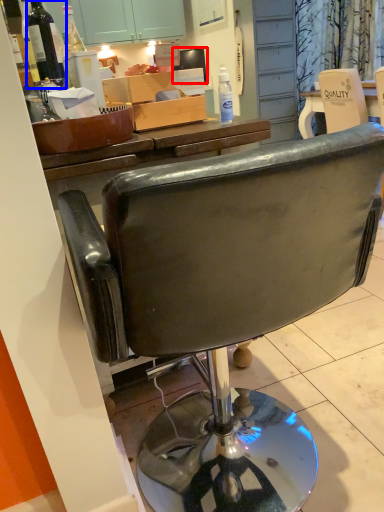
Question: Which object appears closest to the camera in this image, television (highlighted by a red box) or bottle (highlighted by a blue box)?

Choices:
 (A) television
 (B) bottle

Answer: (B)